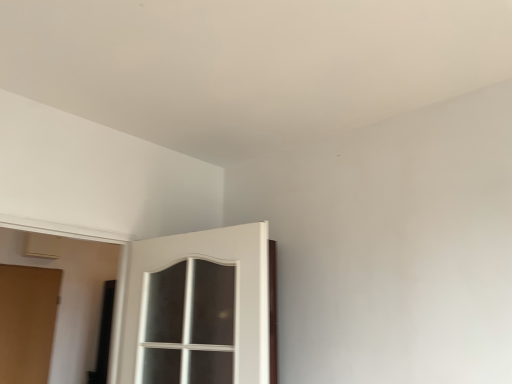
Where is `white glossy door at lower center`? white glossy door at lower center is located at coordinates (198, 308).

Describe the element at coordinates (198, 308) in the screenshot. This screenshot has height=384, width=512. I see `white glossy door at lower center` at that location.

The height and width of the screenshot is (384, 512). I want to click on white glossy door at lower center, so click(198, 308).